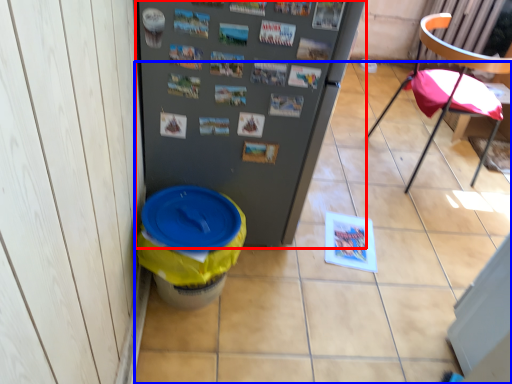
Question: Which point is closer to the camera, refrigerator (highlighted by a red box) or tile (highlighted by a blue box)?

Choices:
 (A) refrigerator
 (B) tile

Answer: (A)